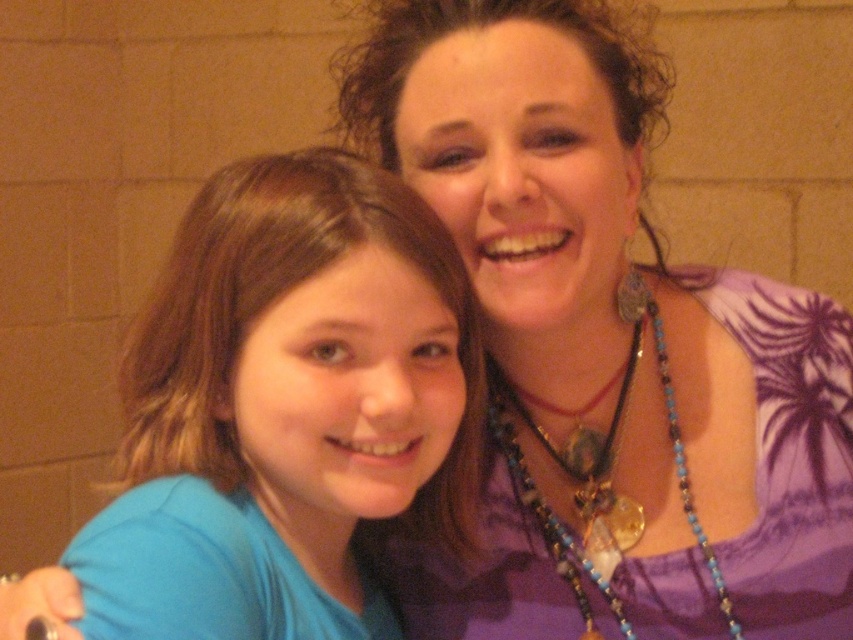
Question: Which point is closer to the camera taking this photo?

Choices:
 (A) (735, 490)
 (B) (326, 353)

Answer: (B)

Question: Which point is closer to the camera?

Choices:
 (A) blue beaded necklace at upper right
 (B) purple fabric at center
 (C) blue fabric shirt at center

Answer: (C)

Question: Can you confirm if purple fabric at center is thinner than blue fabric shirt at center?

Choices:
 (A) no
 (B) yes

Answer: (A)

Question: Is purple fabric at center to the right of blue fabric shirt at center from the viewer's perspective?

Choices:
 (A) no
 (B) yes

Answer: (B)

Question: Which object appears closest to the camera in this image?

Choices:
 (A) purple fabric at center
 (B) blue fabric shirt at center

Answer: (B)

Question: Is purple fabric at center below blue fabric shirt at center?

Choices:
 (A) yes
 (B) no

Answer: (B)